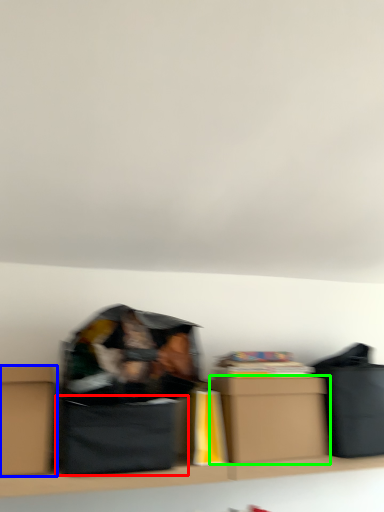
Question: Which object is the closest to the cardboard box (highlighted by a red box)? Choose among these: box (highlighted by a blue box) or box (highlighted by a green box).

Choices:
 (A) box
 (B) box

Answer: (A)